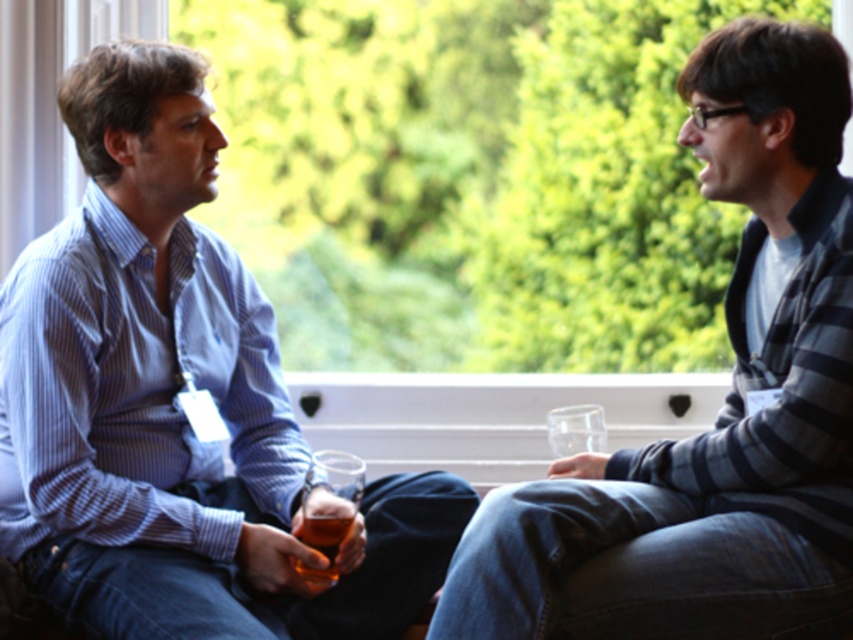
Question: Which point appears closest to the camera in this image?

Choices:
 (A) (669, 472)
 (B) (90, 212)
 (C) (309, 518)

Answer: (A)

Question: Which object appears farthest from the camera in this image?

Choices:
 (A) matte blue shirt at left
 (B) striped sweater at right

Answer: (A)

Question: Can you confirm if striped sweater at right is positioned to the right of translucent glass beer at lower center?

Choices:
 (A) no
 (B) yes

Answer: (B)

Question: Is matte blue shirt at left to the left of translucent glass beer at lower center from the viewer's perspective?

Choices:
 (A) no
 (B) yes

Answer: (B)

Question: Observing the image, what is the correct spatial positioning of matte blue shirt at left in reference to translucent glass beer at lower center?

Choices:
 (A) above
 (B) below

Answer: (A)

Question: Which object is positioned closest to the translucent glass beer at lower center?

Choices:
 (A) striped sweater at right
 (B) matte blue shirt at left

Answer: (B)